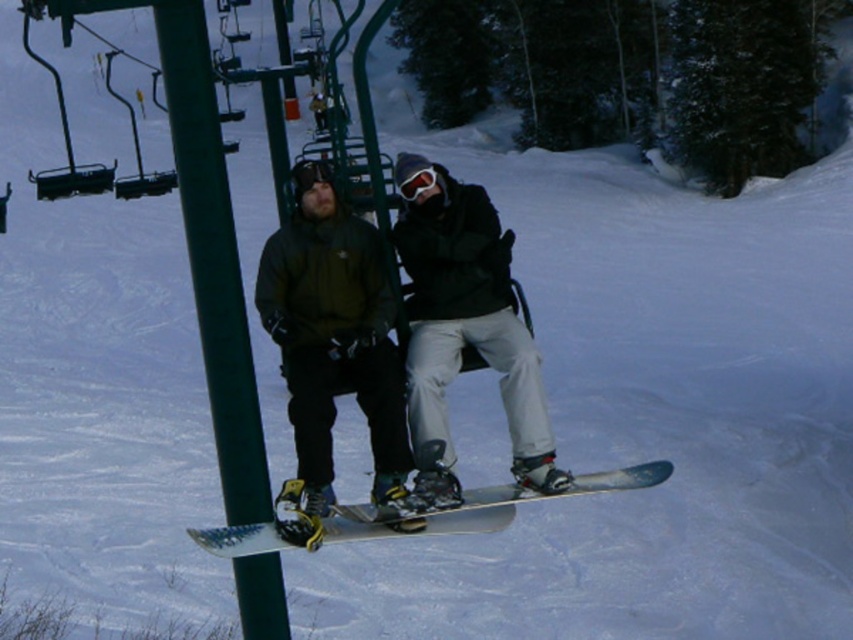
Question: Does matte black snowboard at center come in front of white matte snowboard at center?

Choices:
 (A) yes
 (B) no

Answer: (B)

Question: Among these points, which one is nearest to the camera?

Choices:
 (A) (273, 584)
 (B) (428, 252)
 (C) (329, 540)
 (D) (381, 413)

Answer: (C)

Question: Among these points, which one is farthest from the camera?

Choices:
 (A) (242, 365)
 (B) (305, 388)
 (C) (433, 406)
 (D) (469, 490)

Answer: (D)

Question: Can you confirm if matte black snowboard at center is positioned to the left of dark green jacket at center?

Choices:
 (A) no
 (B) yes

Answer: (A)

Question: Considering the real-world distances, which object is closest to the white matte snowboard at center?

Choices:
 (A) green metallic pole at left
 (B) dark green jacket at center
 (C) matte black snowboard at center

Answer: (B)

Question: Is matte black snowboard at center positioned before green metallic pole at left?

Choices:
 (A) no
 (B) yes

Answer: (A)